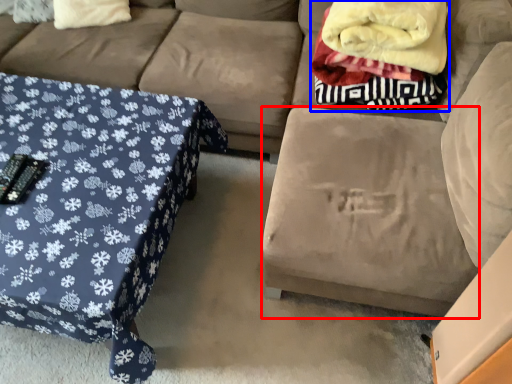
Question: Which object is further to the camera taking this photo, footrest (highlighted by a red box) or blanket (highlighted by a blue box)?

Choices:
 (A) footrest
 (B) blanket

Answer: (B)